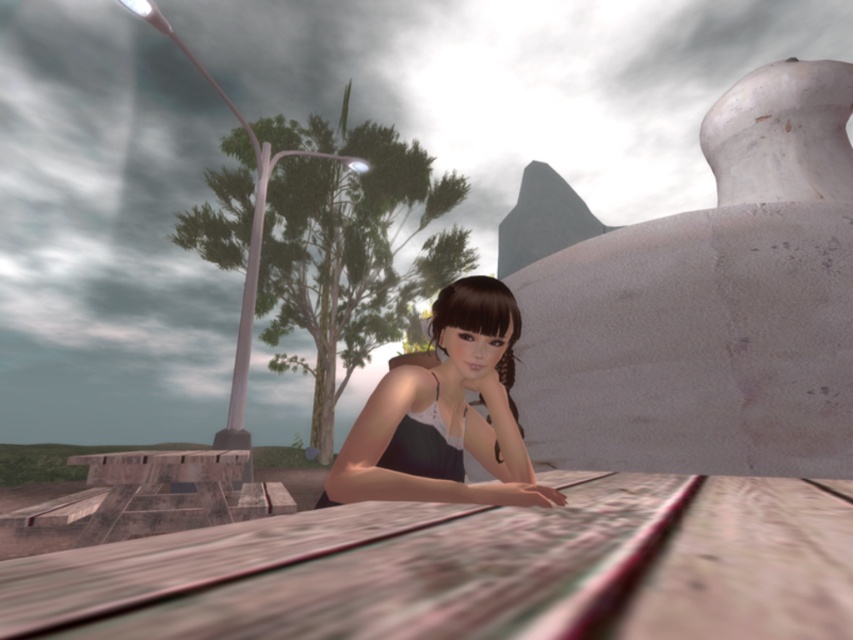
Does wooden picnic table at center have a lesser height compared to matte black dress at center?

Indeed, wooden picnic table at center has a lesser height compared to matte black dress at center.

Can you confirm if wooden picnic table at center is taller than matte black dress at center?

In fact, wooden picnic table at center may be shorter than matte black dress at center.

Find the location of a particular element. This screenshot has width=853, height=640. wooden picnic table at center is located at coordinates (468, 570).